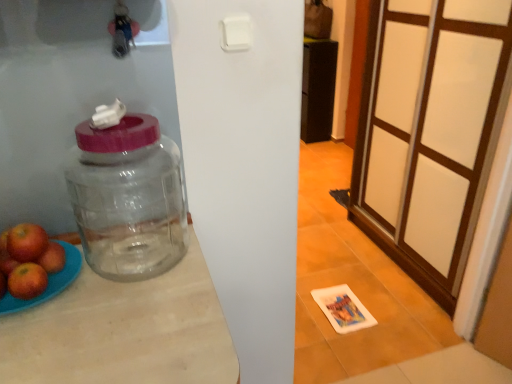
You are a GUI agent. You are given a task and a screenshot of the screen. Output one action in this format:
    pyautogui.click(x=<x>, y=<y>)
    Task: Click on the vacant area that lies in front of transparent glass jar at left
    This screenshot has height=384, width=512.
    Given the screenshot: What is the action you would take?
    pyautogui.click(x=146, y=310)